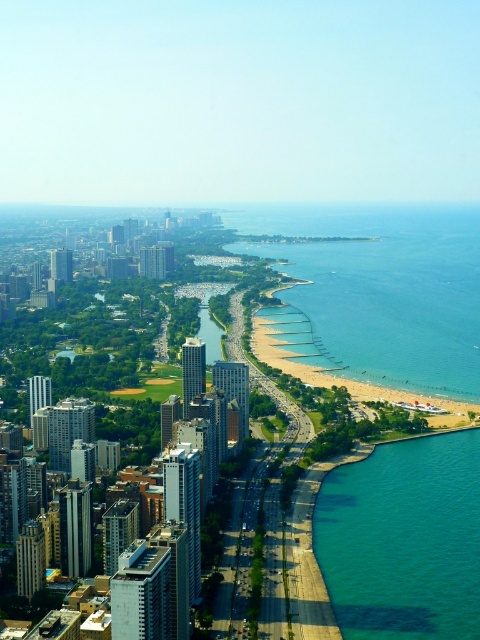
You are standing at the point marked as point [379,291] in the coastal city panorama. What do you see directly in front of you?

You see clear blue water at lower right directly in front of you because the point [379,291] corresponds to that location.

Looking at this image, you are a photographer planning to capture the reflection of the coastal city from the water. You notice two water areas in the scene. Which water area, the clear blue water at lower right or the teal glassy water at lower right, is more likely to provide a better reflection for your photo?

The teal glassy water at lower right is more likely to provide a better reflection because it is described as glassy, which typically indicates a smoother surface that can create clearer reflections compared to the clear blue water at lower right.

You are a drone operator tasked with capturing aerial footage of the coastal city. Your drone is currently hovering at the center of the image. To reach the clear blue water at lower right, in which general direction should you steer the drone? Please specify the direction as a cardinal direction or a combination of cardinal directions.

The clear blue water at lower right is located at coordinates point (379, 291). Since the drone is at the center, it needs to move southeast to reach the clear blue water at lower right.